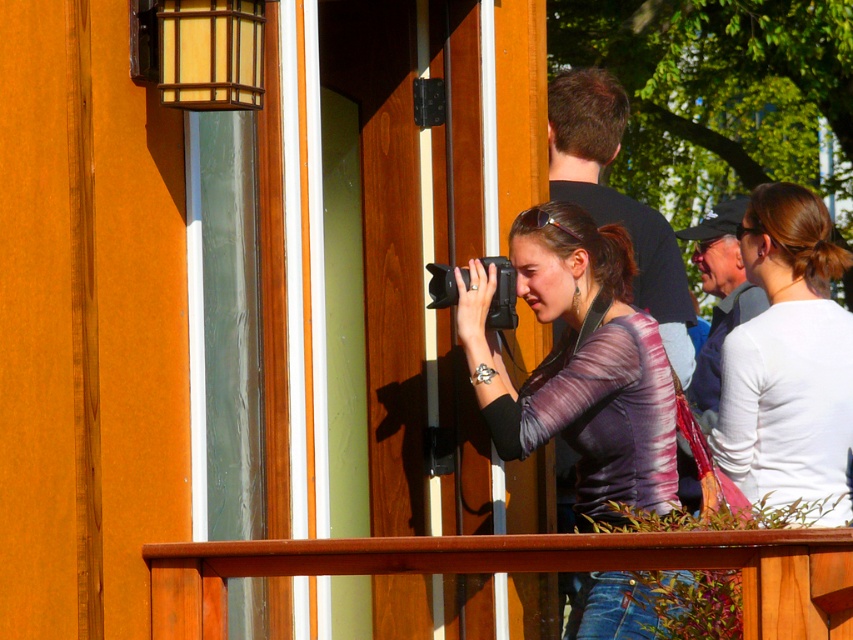
You are a photographer standing on the balcony where the woman is taking a photo. You need to place a 10 feet long tripod between the wooden rail at center and the gray fabric cap at upper right. Is there enough space between them to fit the tripod?

The wooden rail at center is 26.69 feet away from the gray fabric cap at upper right. Since the tripod is only 10 feet long, there is more than enough space to place it between them.

You are a photographer trying to capture a clear shot of the matte purple shirt at center without the wooden rail at center obstructing the view. Based on the scene description, can you position yourself in a way to avoid the rail blocking the shirt?

The matte purple shirt at center is much taller than the wooden rail at center, so positioning yourself lower or angling the camera upwards would allow you to capture the shirt without the rail obstructing the view.